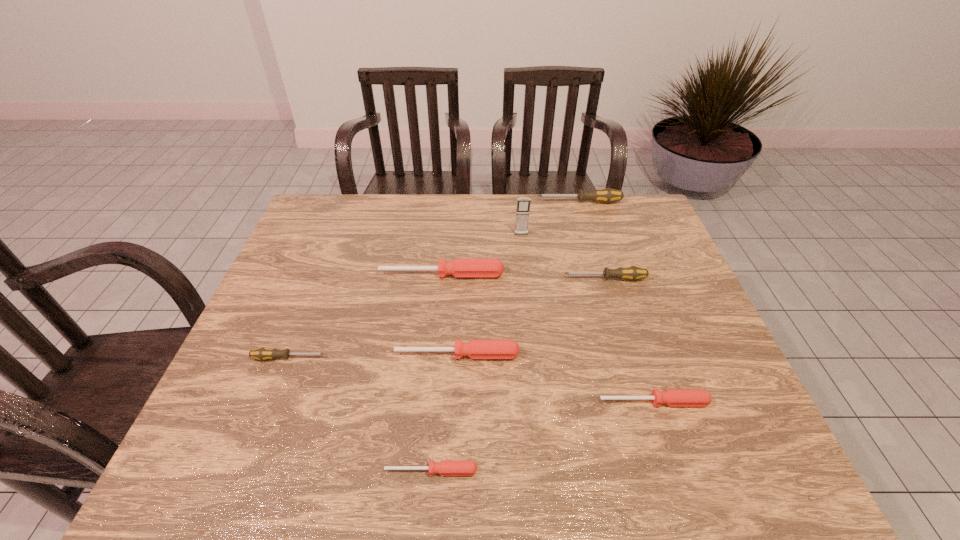
Where is `vacant space located at the tip of the second farthest gray screwdriver`? The height and width of the screenshot is (540, 960). vacant space located at the tip of the second farthest gray screwdriver is located at coordinates (514, 279).

Identify the location of blank space located 0.170m on the left of the third nearest red screwdriver. (325, 355).

Identify the location of vacant space located on the back of the sixth farthest screwdriver. (623, 307).

This screenshot has width=960, height=540. In order to click on vacant space situated at the tip of the leftmost object in this screenshot , I will do `click(418, 358)`.

Find the location of `blank space located on the back of the nearest red screwdriver`. blank space located on the back of the nearest red screwdriver is located at coordinates (444, 318).

At what (x,y) coordinates should I click in order to perform the action: click on cellular telephone situated at the far edge. Please return your answer as a coordinate pair (x, y). Image resolution: width=960 pixels, height=540 pixels. Looking at the image, I should click on (523, 204).

You are a GUI agent. You are given a task and a screenshot of the screen. Output one action in this format:
    pyautogui.click(x=<x>, y=<y>)
    Task: Click on the screwdriver that is positioned at the far edge
    The width and height of the screenshot is (960, 540).
    Given the screenshot: What is the action you would take?
    pyautogui.click(x=607, y=195)

I want to click on object that is at the near edge, so pyautogui.click(x=446, y=467).

The image size is (960, 540). Find the location of `object that is at the left edge`. object that is at the left edge is located at coordinates (263, 353).

Locate an element on the screen. object situated at the far right corner is located at coordinates (607, 195).